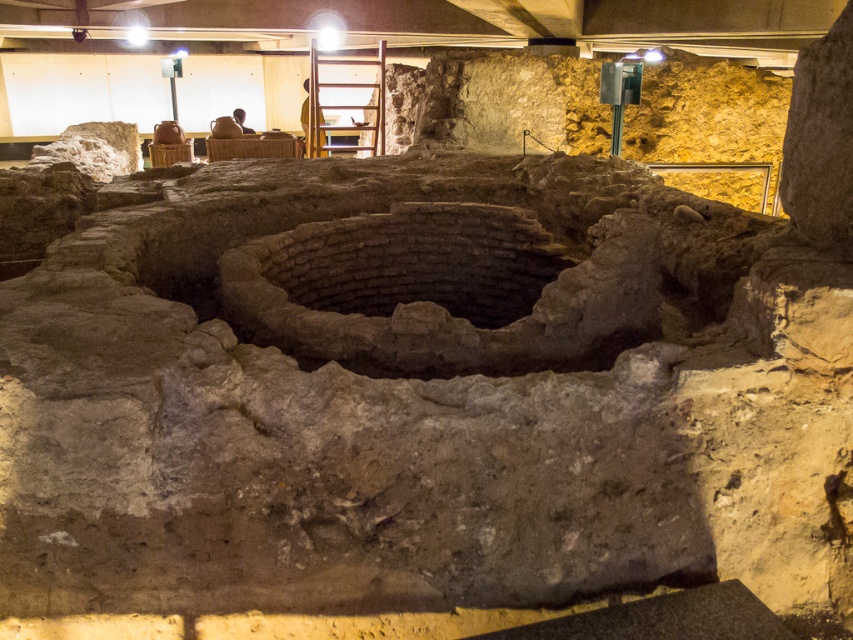
Between wooden ladder at upper center and matte brown vase at upper center, which one appears on the right side from the viewer's perspective?

wooden ladder at upper center is more to the right.

Find the location of a particular element. The width and height of the screenshot is (853, 640). wooden ladder at upper center is located at coordinates (345, 104).

Can you confirm if brown textured stone well at center is positioned above matte brown vase at upper center?

No.

Is brown textured stone well at center shorter than matte brown vase at upper center?

No, brown textured stone well at center is not shorter than matte brown vase at upper center.

The height and width of the screenshot is (640, 853). What do you see at coordinates (418, 260) in the screenshot? I see `brown textured stone well at center` at bounding box center [418, 260].

Where is `brown textured stone well at center`? This screenshot has height=640, width=853. brown textured stone well at center is located at coordinates (418, 260).

Can you confirm if brown textured stone well at center is smaller than brown leather chair at center?

Correct, brown textured stone well at center occupies less space than brown leather chair at center.

Who is positioned more to the left, brown textured stone well at center or brown leather chair at center?

From the viewer's perspective, brown leather chair at center appears more on the left side.

Does point (511, 301) lie behind point (320, 122)?

No, (511, 301) is in front of (320, 122).

I want to click on brown textured stone well at center, so click(418, 260).